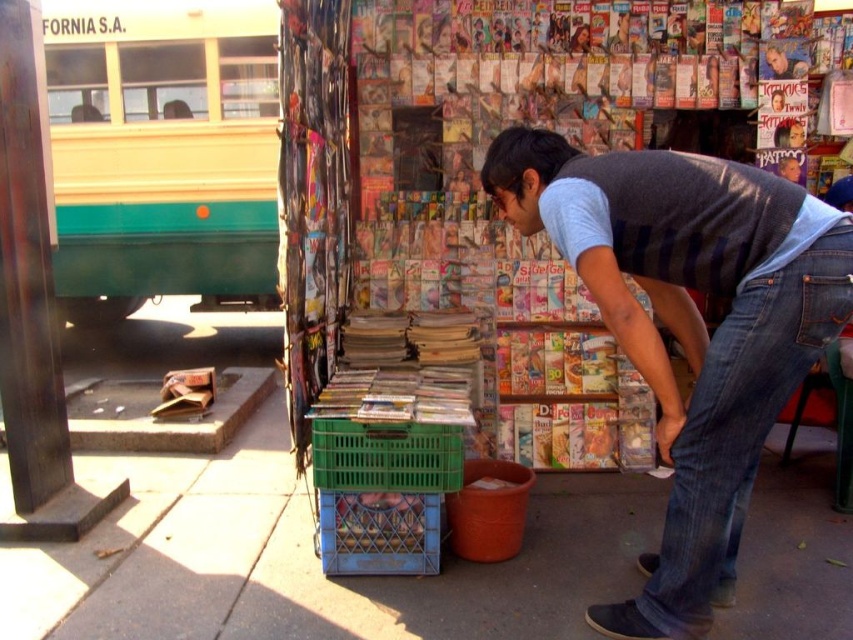
Question: Does smooth concrete pavement at center appear under teal matte bus at left?

Choices:
 (A) yes
 (B) no

Answer: (A)

Question: Observing the image, what is the correct spatial positioning of denim jeans at lower right in reference to denim at lower right?

Choices:
 (A) right
 (B) left

Answer: (B)

Question: Does denim jeans at lower right have a larger size compared to denim at lower right?

Choices:
 (A) yes
 (B) no

Answer: (A)

Question: Which point is farther from the camera taking this photo?

Choices:
 (A) (192, 166)
 (B) (579, 541)
 (C) (755, 432)

Answer: (A)

Question: Which point is farther to the camera?

Choices:
 (A) (839, 291)
 (B) (90, 12)

Answer: (B)

Question: Which object is farther from the camera taking this photo?

Choices:
 (A) denim jeans at lower right
 (B) smooth concrete pavement at center

Answer: (B)